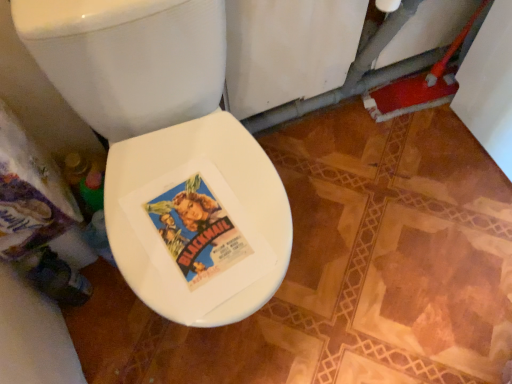
Where is `vacant region above white glossy bidet at center (from a real-world perspective)`? Image resolution: width=512 pixels, height=384 pixels. vacant region above white glossy bidet at center (from a real-world perspective) is located at coordinates [x=196, y=230].